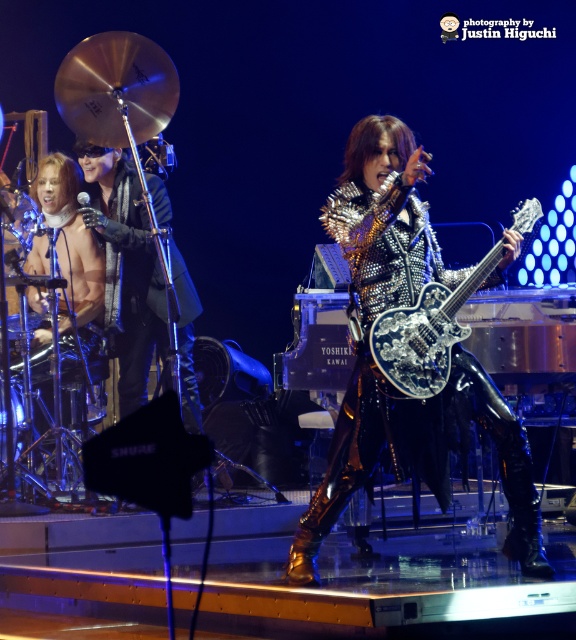
Question: Which object is farther from the camera taking this photo?

Choices:
 (A) shiny metallic guitar at center
 (B) silver metallic guitar at center

Answer: (B)

Question: Can you confirm if shiny metallic guitar at center is wider than silver metallic guitar at center?

Choices:
 (A) yes
 (B) no

Answer: (A)

Question: Is shiny metallic guitar at center further to camera compared to silver metallic guitar at center?

Choices:
 (A) yes
 (B) no

Answer: (B)

Question: Does shiny metallic guitar at center appear over silver metallic guitar at center?

Choices:
 (A) yes
 (B) no

Answer: (B)

Question: Which object appears farthest from the camera in this image?

Choices:
 (A) shiny metallic guitar at center
 (B) silver metallic guitar at center

Answer: (B)